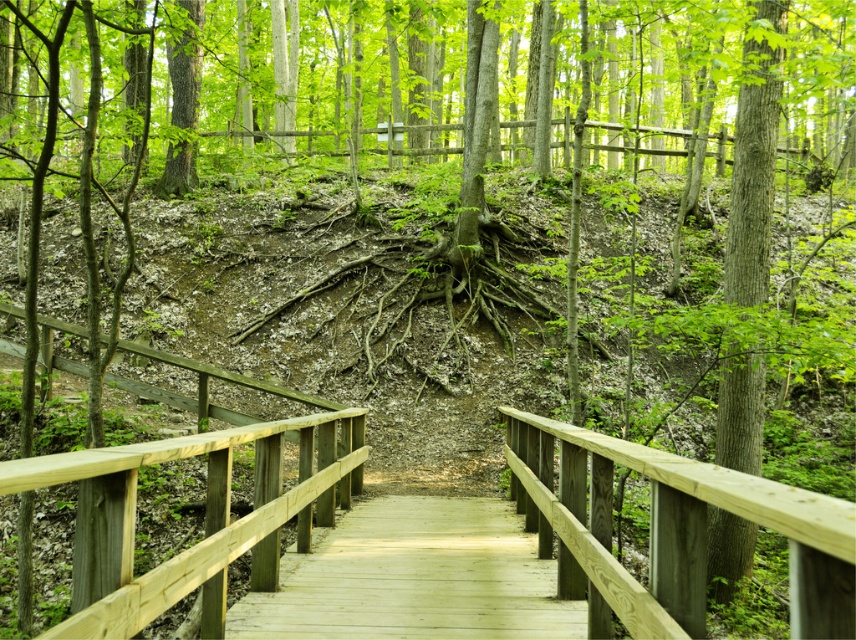
You are standing on the wooden boardwalk in the forest and notice two points marked on the boardwalk. One is at coordinate point (349, 545) and the other at point (749, 292). Which point is closer to you as you stand on the boardwalk?

Point (349, 545) is closer to the viewer than point (749, 292).